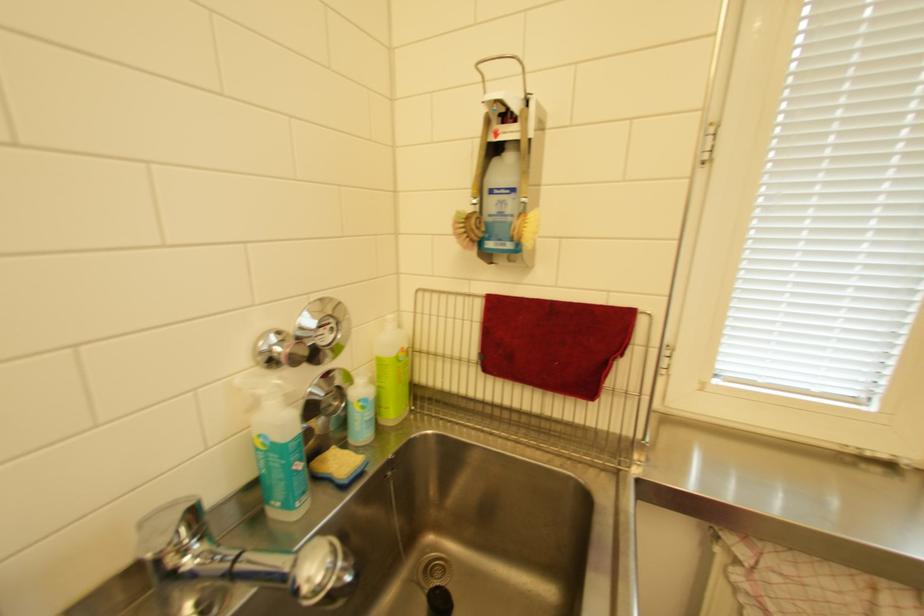
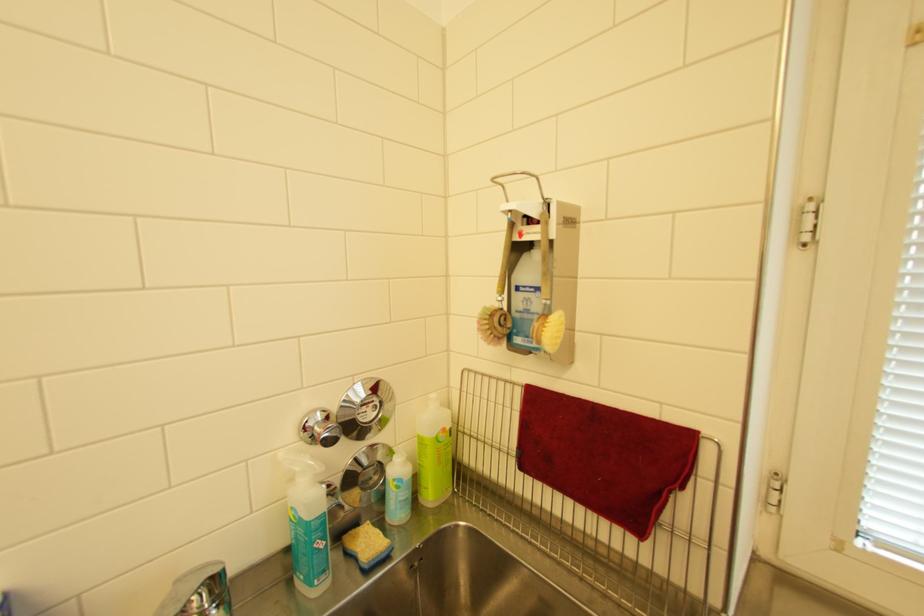
Question: The images are taken continuously from a first-person perspective. In which direction are you moving?

Choices:
 (A) Left
 (B) Right
 (C) Forward
 (D) Backward

Answer: (B)